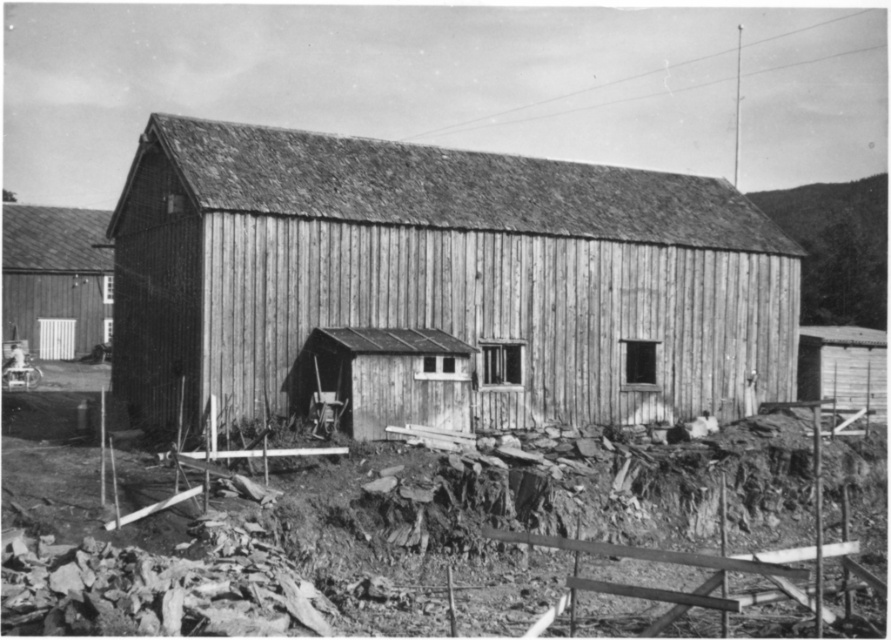
Looking at this image, you are a painter who needs to move a ladder from the wooden hut at center to the smooth wooden door at left. Which object is wider so that the ladder can be placed on top of it?

The wooden hut at center is wider than the smooth wooden door at left, so the ladder can be placed on top of the wooden hut at center.

You are a delivery person approaching the wooden barn and need to locate the entrance. You see the wooden hut at center and the smooth wooden door at left. According to the scene, which object is positioned lower in relation to the other?

The wooden hut at center is positioned below the smooth wooden door at left, so it is lower in relation to the smooth wooden door at left.